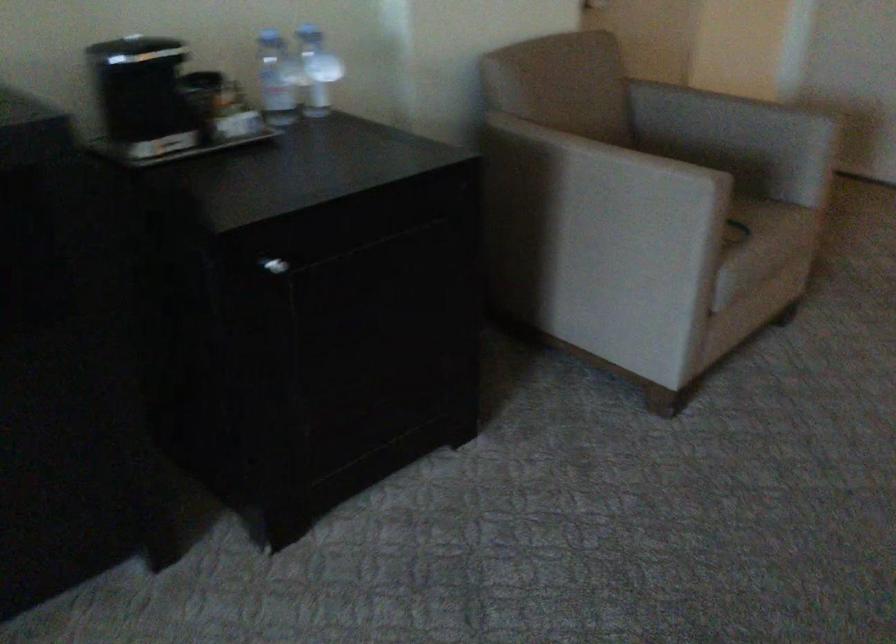
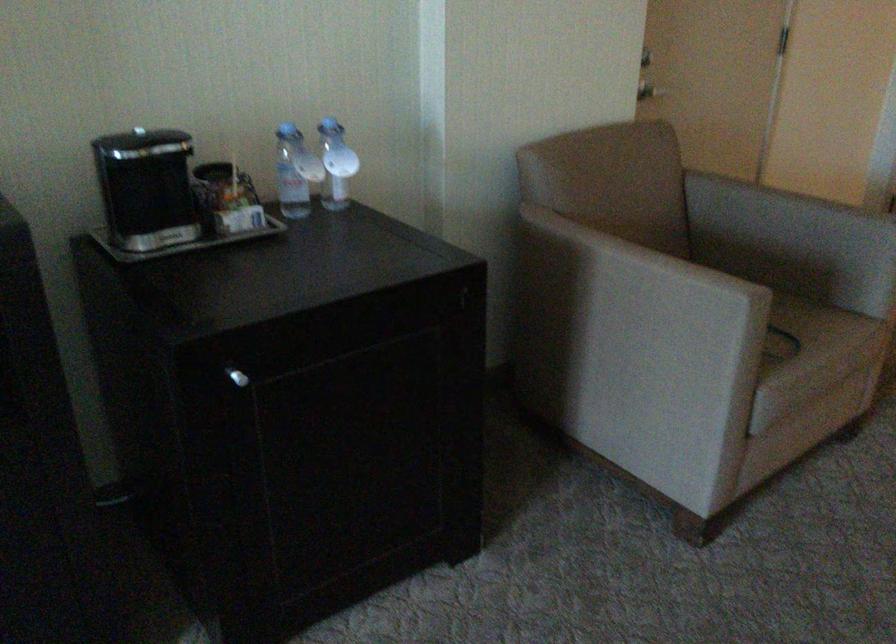
The point at (x=600, y=182) is marked in the first image. Where is the corresponding point in the second image?

(631, 283)